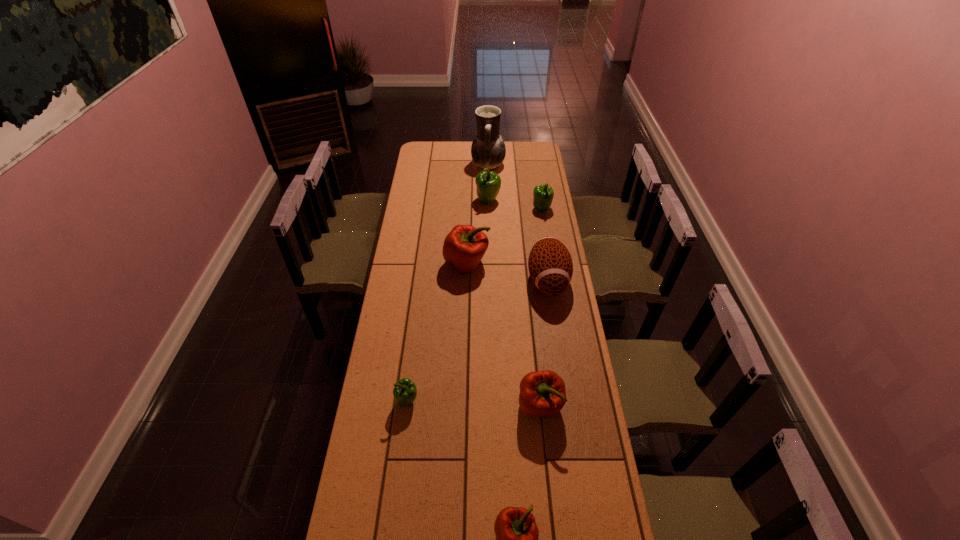
Find the location of a particular element. This screenshot has height=540, width=960. vacant space that's between the second biggest green bell pepper and the leftmost object is located at coordinates (474, 305).

Image resolution: width=960 pixels, height=540 pixels. What are the coordinates of `object identified as the third closest to the second green bell pepper from left to right` in the screenshot? It's located at (464, 247).

At what (x,y) coordinates should I click in order to perform the action: click on object that ranks as the fourth closest to the second smallest green bell pepper. Please return your answer as a coordinate pair (x, y). The width and height of the screenshot is (960, 540). Looking at the image, I should click on (464, 247).

Identify which bell pepper is located as the third nearest to the smallest pink bell pepper. Please provide its 2D coordinates. Your answer should be formatted as a tuple, i.e. [(x, y)], where the tuple contains the x and y coordinates of a point satisfying the conditions above.

[(464, 247)]

Choose which bell pepper is the fourth nearest neighbor to the football. Please provide its 2D coordinates. Your answer should be formatted as a tuple, i.e. [(x, y)], where the tuple contains the x and y coordinates of a point satisfying the conditions above.

[(488, 183)]

Locate which green bell pepper is the closest to the biggest green bell pepper. Please provide its 2D coordinates. Your answer should be formatted as a tuple, i.e. [(x, y)], where the tuple contains the x and y coordinates of a point satisfying the conditions above.

[(543, 195)]

Find the location of `green bell pepper that is the third closest one to the pitcher`. green bell pepper that is the third closest one to the pitcher is located at coordinates (405, 392).

Find the location of `pink bell pepper that is the third closest to the leftmost green bell pepper`. pink bell pepper that is the third closest to the leftmost green bell pepper is located at coordinates (464, 247).

Select which pink bell pepper is the closest to the biggest pink bell pepper. Please provide its 2D coordinates. Your answer should be formatted as a tuple, i.e. [(x, y)], where the tuple contains the x and y coordinates of a point satisfying the conditions above.

[(542, 393)]

At what (x,y) coordinates should I click in order to perform the action: click on free space that satisfies the following two spatial constraints: 1. on the front-facing side of the pitcher; 2. on the front side of the leftmost green bell pepper. Please return your answer as a coordinate pair (x, y). The image size is (960, 540). Looking at the image, I should click on (493, 401).